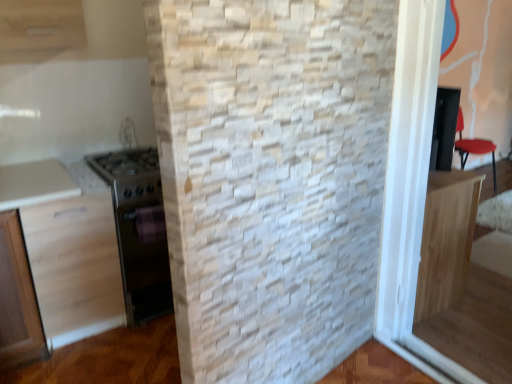
Where is `metallic stainless steel oven at left`? metallic stainless steel oven at left is located at coordinates (136, 230).

Describe the element at coordinates (446, 239) in the screenshot. I see `light wood cabinet at right, the 2th cabinetry positioned from the left` at that location.

What is the approximate height of light wood cabinet at left, arranged as the first cabinetry when viewed from the left?

light wood cabinet at left, arranged as the first cabinetry when viewed from the left, is 33.79 inches in height.

Locate an element on the screen. The image size is (512, 384). metallic stainless steel oven at left is located at coordinates (136, 230).

From a real-world perspective, which is physically below, light wood cabinet at left, arranged as the first cabinetry when viewed from the left, or metallic stainless steel oven at left?

metallic stainless steel oven at left, from a real-world perspective.

Considering the positions of objects light wood cabinet at left, which is counted as the 2th cabinetry, starting from the right, and metallic stainless steel oven at left in the image provided, who is more to the right, light wood cabinet at left, which is counted as the 2th cabinetry, starting from the right, or metallic stainless steel oven at left?

From the viewer's perspective, metallic stainless steel oven at left appears more on the right side.

Find the location of `cabinetry below the metallic stainless steel oven at left (from the image's perspective)`. cabinetry below the metallic stainless steel oven at left (from the image's perspective) is located at coordinates (57, 276).

Would you say metallic stainless steel oven at left is part of light wood cabinet at left, which is counted as the 2th cabinetry, starting from the right,'s contents?

Actually, metallic stainless steel oven at left is outside light wood cabinet at left, which is counted as the 2th cabinetry, starting from the right.

Is metallic stainless steel oven at left positioned with its back to light wood cabinet at right, the 1th cabinetry from the right?

No, metallic stainless steel oven at left is not facing the opposite direction of light wood cabinet at right, the 1th cabinetry from the right.

Which is more to the right, metallic stainless steel oven at left or light wood cabinet at right, the 1th cabinetry from the right?

Positioned to the right is light wood cabinet at right, the 1th cabinetry from the right.

Who is taller, metallic stainless steel oven at left or light wood cabinet at right, the 2th cabinetry positioned from the left?

light wood cabinet at right, the 2th cabinetry positioned from the left, is taller.

Are metallic stainless steel oven at left and light wood cabinet at left, arranged as the first cabinetry when viewed from the left, far apart?

Actually, metallic stainless steel oven at left and light wood cabinet at left, arranged as the first cabinetry when viewed from the left, are a little close together.

What's the angular difference between metallic stainless steel oven at left and light wood cabinet at left, which is counted as the 2th cabinetry, starting from the right,'s facing directions?

0.154 degrees.

From their relative heights in the image, would you say metallic stainless steel oven at left is taller or shorter than light wood cabinet at left, arranged as the first cabinetry when viewed from the left?

Clearly, metallic stainless steel oven at left is shorter compared to light wood cabinet at left, arranged as the first cabinetry when viewed from the left.

From the image's perspective, does light wood cabinet at right, the 2th cabinetry positioned from the left, appear higher than light wood cabinet at left, arranged as the first cabinetry when viewed from the left?

Yes, from the image's perspective, light wood cabinet at right, the 2th cabinetry positioned from the left, is on top of light wood cabinet at left, arranged as the first cabinetry when viewed from the left.

Is light wood cabinet at right, the 2th cabinetry positioned from the left, thinner than light wood cabinet at left, arranged as the first cabinetry when viewed from the left?

Yes, light wood cabinet at right, the 2th cabinetry positioned from the left, is thinner than light wood cabinet at left, arranged as the first cabinetry when viewed from the left.

Is point (424, 313) less distant than point (88, 295)?

No, it is behind (88, 295).

From a real-world perspective, which object stands above the other?

light wood cabinet at left, which is counted as the 2th cabinetry, starting from the right, from a real-world perspective.

Is light wood cabinet at right, the 2th cabinetry positioned from the left, surrounding metallic stainless steel oven at left?

That's incorrect, metallic stainless steel oven at left is not inside light wood cabinet at right, the 2th cabinetry positioned from the left.

Looking at the image, does light wood cabinet at right, the 1th cabinetry from the right, seem bigger or smaller compared to metallic stainless steel oven at left?

In the image, light wood cabinet at right, the 1th cabinetry from the right, appears to be smaller than metallic stainless steel oven at left.

Is light wood cabinet at right, the 2th cabinetry positioned from the left, next to metallic stainless steel oven at left and touching it?

light wood cabinet at right, the 2th cabinetry positioned from the left, is not next to metallic stainless steel oven at left, and they're not touching.

Who is shorter, light wood cabinet at left, which is counted as the 2th cabinetry, starting from the right, or light wood cabinet at right, the 2th cabinetry positioned from the left?

light wood cabinet at right, the 2th cabinetry positioned from the left.

Is light wood cabinet at left, arranged as the first cabinetry when viewed from the left, located outside light wood cabinet at right, the 2th cabinetry positioned from the left?

Yes.

Considering the positions of objects light wood cabinet at left, arranged as the first cabinetry when viewed from the left, and light wood cabinet at right, the 1th cabinetry from the right, in the image provided, who is more to the left, light wood cabinet at left, arranged as the first cabinetry when viewed from the left, or light wood cabinet at right, the 1th cabinetry from the right,?

light wood cabinet at left, arranged as the first cabinetry when viewed from the left.

Identify the location of cabinetry above the light wood cabinet at right, the 2th cabinetry positioned from the left (from a real-world perspective). The width and height of the screenshot is (512, 384). (57, 276).

This screenshot has height=384, width=512. Find the location of `appliance behind the light wood cabinet at left, which is counted as the 2th cabinetry, starting from the right`. appliance behind the light wood cabinet at left, which is counted as the 2th cabinetry, starting from the right is located at coordinates (136, 230).

Identify the location of cabinetry on the right of metallic stainless steel oven at left. The image size is (512, 384). (446, 239).

Which object lies nearer to the anchor point light wood cabinet at left, which is counted as the 2th cabinetry, starting from the right, metallic stainless steel oven at left or light wood cabinet at right, the 1th cabinetry from the right?

metallic stainless steel oven at left.

Considering their positions, is light wood cabinet at right, the 2th cabinetry positioned from the left, positioned closer to light wood cabinet at left, arranged as the first cabinetry when viewed from the left, than metallic stainless steel oven at left?

Based on the image, metallic stainless steel oven at left appears to be nearer to light wood cabinet at left, arranged as the first cabinetry when viewed from the left.

Which object lies further to the anchor point light wood cabinet at right, the 2th cabinetry positioned from the left, light wood cabinet at left, which is counted as the 2th cabinetry, starting from the right, or metallic stainless steel oven at left?

The object further to light wood cabinet at right, the 2th cabinetry positioned from the left, is light wood cabinet at left, which is counted as the 2th cabinetry, starting from the right.

Looking at the image, which one is located further to metallic stainless steel oven at left, light wood cabinet at left, arranged as the first cabinetry when viewed from the left, or light wood cabinet at right, the 1th cabinetry from the right?

Among the two, light wood cabinet at right, the 1th cabinetry from the right, is located further to metallic stainless steel oven at left.

Considering their positions, is metallic stainless steel oven at left positioned closer to light wood cabinet at right, the 2th cabinetry positioned from the left, than light wood cabinet at left, arranged as the first cabinetry when viewed from the left?

metallic stainless steel oven at left is positioned closer to the anchor light wood cabinet at right, the 2th cabinetry positioned from the left.

Based on their spatial positions, is light wood cabinet at right, the 2th cabinetry positioned from the left, or light wood cabinet at left, arranged as the first cabinetry when viewed from the left, further from metallic stainless steel oven at left?

The object further to metallic stainless steel oven at left is light wood cabinet at right, the 2th cabinetry positioned from the left.

Locate an element on the screen. This screenshot has height=384, width=512. appliance situated between light wood cabinet at left, arranged as the first cabinetry when viewed from the left, and light wood cabinet at right, the 2th cabinetry positioned from the left, from left to right is located at coordinates (136, 230).